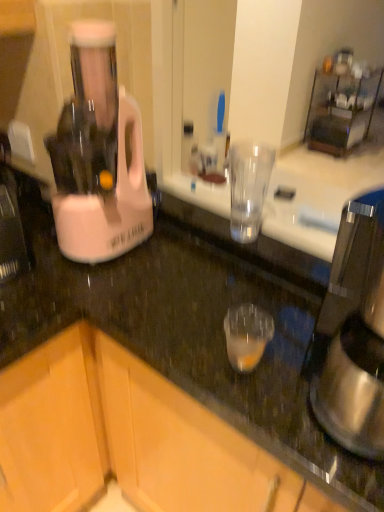
Question: Should I look upward or downward to see wooden cabinet at lower left, which ranks as the first cabinetry in left-to-right order?

Choices:
 (A) down
 (B) up

Answer: (A)

Question: Is wooden cabinet at lower left, which ranks as the 2th cabinetry in right-to-left order, completely or partially inside wooden cabinet at lower left, which is counted as the 1th cabinetry, starting from the right?

Choices:
 (A) no
 (B) yes

Answer: (B)

Question: Can you confirm if wooden cabinet at lower left, which is counted as the 1th cabinetry, starting from the right, is positioned to the left of wooden cabinet at lower left, which ranks as the 2th cabinetry in right-to-left order?

Choices:
 (A) yes
 (B) no

Answer: (B)

Question: Is wooden cabinet at lower left, acting as the second cabinetry starting from the left, shorter than wooden cabinet at lower left, which ranks as the 2th cabinetry in right-to-left order?

Choices:
 (A) yes
 (B) no

Answer: (B)

Question: Is wooden cabinet at lower left, acting as the second cabinetry starting from the left, looking in the opposite direction of wooden cabinet at lower left, which ranks as the 2th cabinetry in right-to-left order?

Choices:
 (A) yes
 (B) no

Answer: (A)

Question: From a real-world perspective, does wooden cabinet at lower left, acting as the second cabinetry starting from the left, sit lower than wooden cabinet at lower left, which ranks as the first cabinetry in left-to-right order?

Choices:
 (A) yes
 (B) no

Answer: (B)

Question: Does wooden cabinet at lower left, which is counted as the 1th cabinetry, starting from the right, have a greater width compared to wooden cabinet at lower left, which ranks as the first cabinetry in left-to-right order?

Choices:
 (A) no
 (B) yes

Answer: (B)

Question: From the image's perspective, is wooden cabinet at lower left, which ranks as the first cabinetry in left-to-right order, on satin silver coffee maker at right?

Choices:
 (A) yes
 (B) no

Answer: (B)

Question: Is wooden cabinet at lower left, which ranks as the 2th cabinetry in right-to-left order, not within satin silver coffee maker at right?

Choices:
 (A) yes
 (B) no

Answer: (A)

Question: Is the position of wooden cabinet at lower left, which ranks as the first cabinetry in left-to-right order, more distant than that of satin silver coffee maker at right?

Choices:
 (A) no
 (B) yes

Answer: (B)

Question: Is wooden cabinet at lower left, which ranks as the first cabinetry in left-to-right order, oriented away from satin silver coffee maker at right?

Choices:
 (A) yes
 (B) no

Answer: (B)

Question: Does wooden cabinet at lower left, which ranks as the 2th cabinetry in right-to-left order, have a lesser width compared to satin silver coffee maker at right?

Choices:
 (A) no
 (B) yes

Answer: (A)

Question: Is wooden cabinet at lower left, which ranks as the 2th cabinetry in right-to-left order, positioned far away from satin silver coffee maker at right?

Choices:
 (A) no
 (B) yes

Answer: (A)

Question: Is wooden cabinet at lower left, which is counted as the 1th cabinetry, starting from the right, smaller than satin silver coffee maker at right?

Choices:
 (A) no
 (B) yes

Answer: (A)